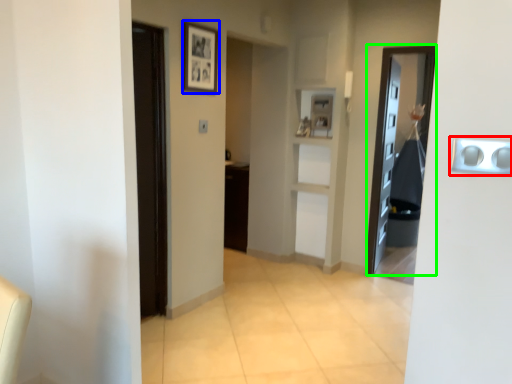
Question: Which is nearer to the door handle (highlighted by a red box)? picture frame (highlighted by a blue box) or door (highlighted by a green box).

Choices:
 (A) picture frame
 (B) door

Answer: (A)